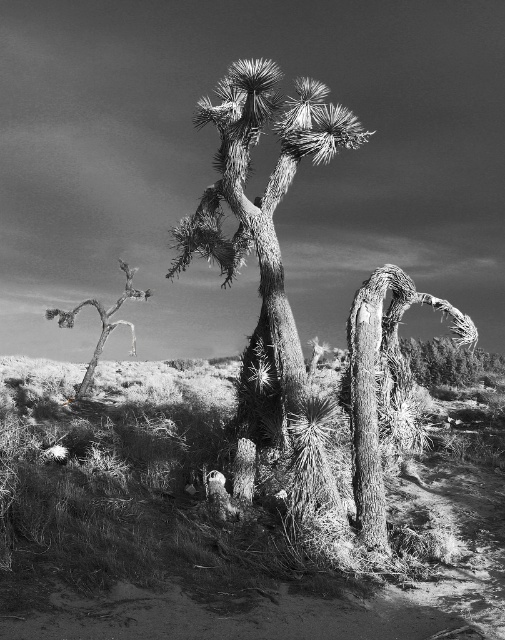
Question: Is the position of rough bark joshua tree at center more distant than that of scraggly white tree at left?

Choices:
 (A) yes
 (B) no

Answer: (B)

Question: Does rough bark joshua tree at center appear on the left side of rough textured tree at center?

Choices:
 (A) no
 (B) yes

Answer: (B)

Question: Which object is closer to the camera taking this photo?

Choices:
 (A) scraggly white tree at left
 (B) rough textured tree at center
 (C) rough bark joshua tree at center

Answer: (B)

Question: Estimate the real-world distances between objects in this image. Which object is closer to the scraggly white tree at left?

Choices:
 (A) rough bark joshua tree at center
 (B) rough textured tree at center

Answer: (A)

Question: Does rough textured tree at center appear under scraggly white tree at left?

Choices:
 (A) yes
 (B) no

Answer: (A)

Question: Based on their relative distances, which object is farther from the rough textured tree at center?

Choices:
 (A) rough bark joshua tree at center
 (B) scraggly white tree at left

Answer: (B)